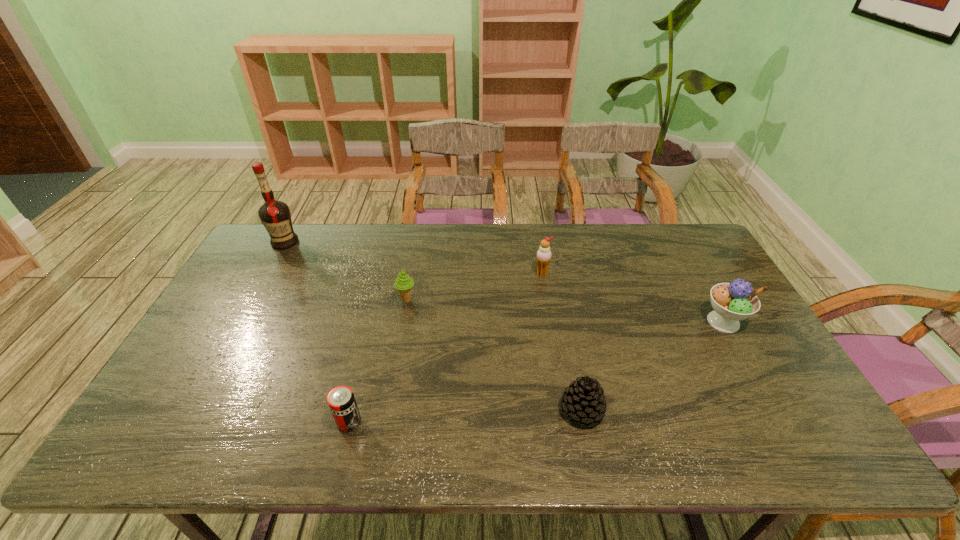
Identify the location of vacant space located 0.110m on the left of the rightmost object. The width and height of the screenshot is (960, 540). (663, 322).

This screenshot has height=540, width=960. What are the coordinates of `free space located at the front with a straw on the fifth nearest object` in the screenshot? It's located at [x=546, y=299].

Locate an element on the screen. The width and height of the screenshot is (960, 540). free space located 0.110m on the back of the fourth object from right to left is located at coordinates (412, 270).

Find the location of a particular element. blank area located at the narrow end of the pinecone is located at coordinates (427, 410).

Find the location of `free point located 0.060m at the narrow end of the pinecone`. free point located 0.060m at the narrow end of the pinecone is located at coordinates (535, 410).

Where is `blank space located at the narrow end of the pinecone`? blank space located at the narrow end of the pinecone is located at coordinates click(415, 410).

Find the location of `free space located on the left of the second object from left to right`. free space located on the left of the second object from left to right is located at coordinates (235, 422).

Image resolution: width=960 pixels, height=540 pixels. In order to click on object that is at the far edge in this screenshot , I will do `click(275, 215)`.

Image resolution: width=960 pixels, height=540 pixels. What are the coordinates of `pinecone at the near edge` in the screenshot? It's located at (584, 402).

Image resolution: width=960 pixels, height=540 pixels. I want to click on can located in the near edge section of the desktop, so [x=341, y=400].